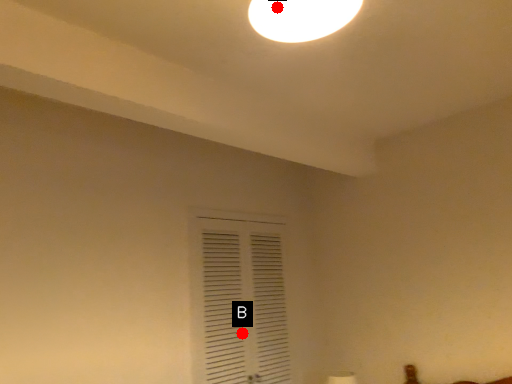
Question: Two points are circled on the image, labeled by A and B beside each circle. Which point appears farthest from the camera in this image?

Choices:
 (A) A is further
 (B) B is further

Answer: (B)